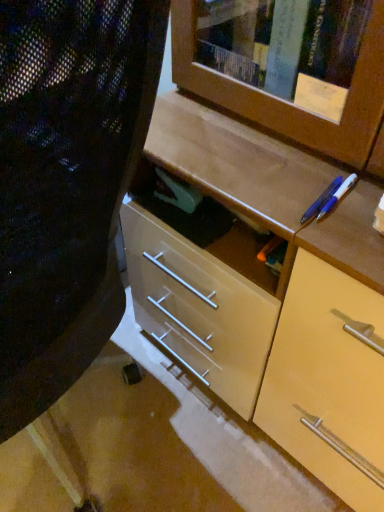
Question: Is matte black folding chair at center outside of blue plastic pen at upper right, which is the 2th pencil in left-to-right order?

Choices:
 (A) yes
 (B) no

Answer: (A)

Question: Are matte black folding chair at center and blue plastic pen at upper right, the first pencil in the right-to-left sequence, beside each other?

Choices:
 (A) yes
 (B) no

Answer: (B)

Question: Is matte black folding chair at center far away from blue plastic pen at upper right, which is the 2th pencil in left-to-right order?

Choices:
 (A) yes
 (B) no

Answer: (B)

Question: Is matte black folding chair at center facing away from blue plastic pen at upper right, the first pencil in the right-to-left sequence?

Choices:
 (A) no
 (B) yes

Answer: (A)

Question: Is matte black folding chair at center to the left of blue plastic pen at upper right, the first pencil in the right-to-left sequence, from the viewer's perspective?

Choices:
 (A) no
 (B) yes

Answer: (B)

Question: Is matte black folding chair at center closer to camera compared to blue plastic pen at upper right, the first pencil in the right-to-left sequence?

Choices:
 (A) no
 (B) yes

Answer: (B)

Question: From a real-world perspective, is blue plastic pen at upper right, the first pencil in the right-to-left sequence, physically below blue glossy pen at upper right, placed as the 1th pencil when sorted from left to right?

Choices:
 (A) yes
 (B) no

Answer: (A)

Question: Is blue plastic pen at upper right, which is the 2th pencil in left-to-right order, aimed at blue glossy pen at upper right, which is the second pencil from right to left?

Choices:
 (A) yes
 (B) no

Answer: (B)

Question: Is blue plastic pen at upper right, which is the 2th pencil in left-to-right order, behind blue glossy pen at upper right, placed as the 1th pencil when sorted from left to right?

Choices:
 (A) yes
 (B) no

Answer: (A)

Question: Considering the relative sizes of blue plastic pen at upper right, which is the 2th pencil in left-to-right order, and blue glossy pen at upper right, which is the second pencil from right to left, in the image provided, is blue plastic pen at upper right, which is the 2th pencil in left-to-right order, wider than blue glossy pen at upper right, which is the second pencil from right to left,?

Choices:
 (A) no
 (B) yes

Answer: (A)

Question: From the image's perspective, is blue plastic pen at upper right, which is the 2th pencil in left-to-right order, on blue glossy pen at upper right, placed as the 1th pencil when sorted from left to right?

Choices:
 (A) yes
 (B) no

Answer: (B)

Question: Can you confirm if blue plastic pen at upper right, the first pencil in the right-to-left sequence, is positioned to the right of blue glossy pen at upper right, which is the second pencil from right to left?

Choices:
 (A) no
 (B) yes

Answer: (B)

Question: Can you confirm if blue plastic pen at upper right, which is the 2th pencil in left-to-right order, is bigger than matte black folding chair at center?

Choices:
 (A) yes
 (B) no

Answer: (B)